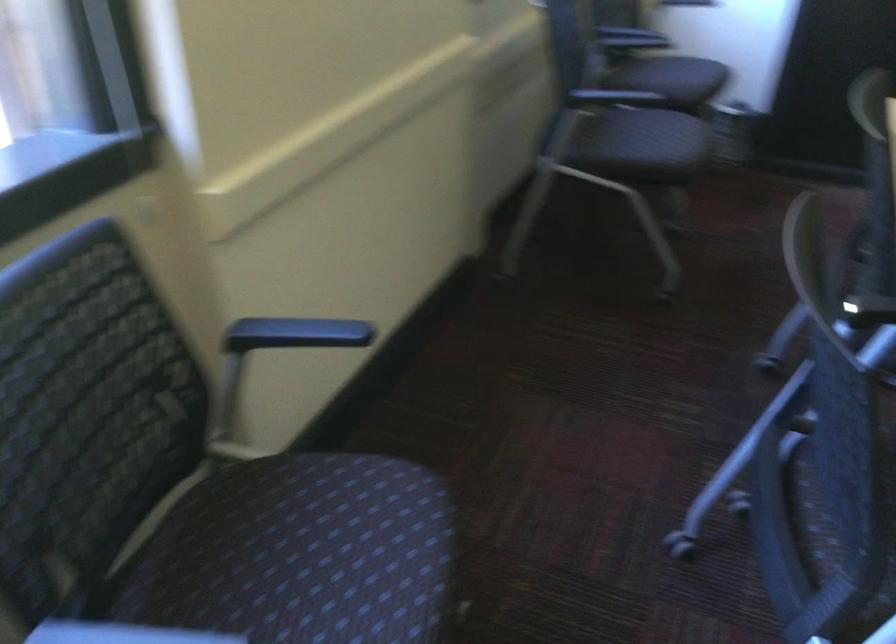
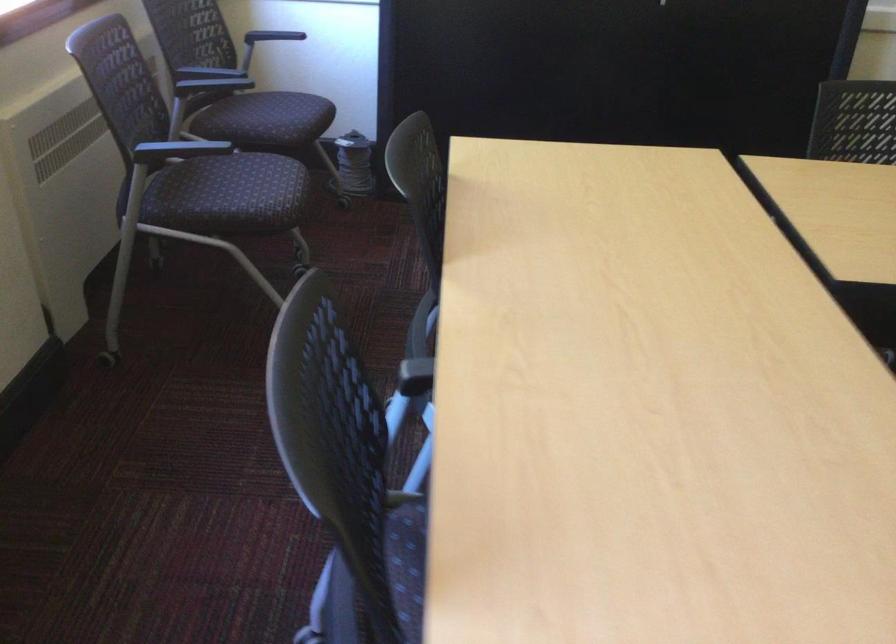
Question: I am providing you with two images of the same scene from different viewpoints. Which of the following objects are not visible in image2?

Choices:
 (A) black chair armrest
 (B) chair sitting surface
 (C) spool of wire
 (D) none of these

Answer: (D)